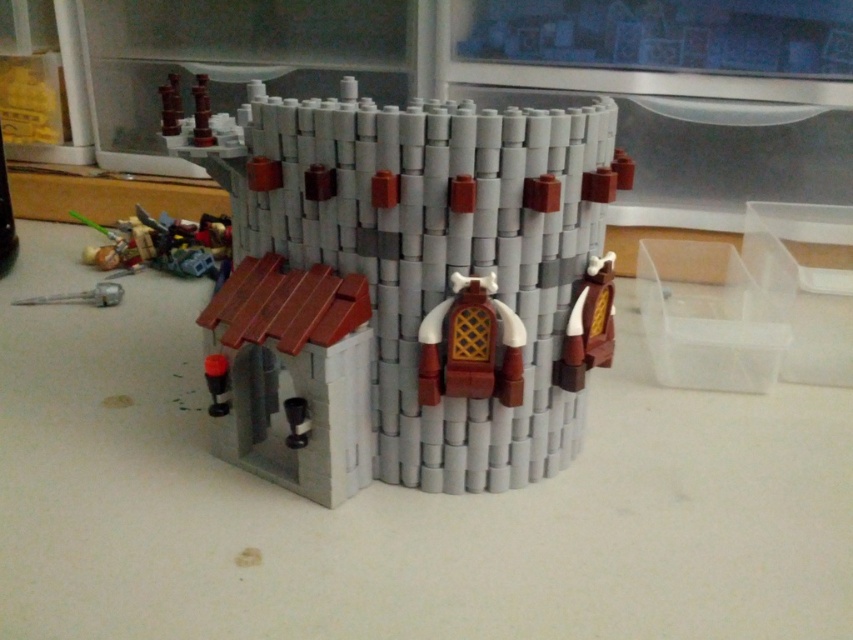
You are a knight standing at the base of the LEGO castle turret. You notice a shiny plastic sword at lower left and a matte gray pipe at lower left. Which object is positioned higher relative to the other?

The shiny plastic sword at lower left is located above the matte gray pipe at lower left, so it is positioned higher.

You are an architect designing a medieval LEGO set and want to place a decorative golden shield between the brown matte armor at center and the matte black cylinder at lower left. Based on their positions, which object should the shield be closer to?

The brown matte armor at center is positioned on the right side of the matte black cylinder at lower left. Therefore, the decorative golden shield should be placed closer to the brown matte armor at center to maintain symmetry between the two objects.